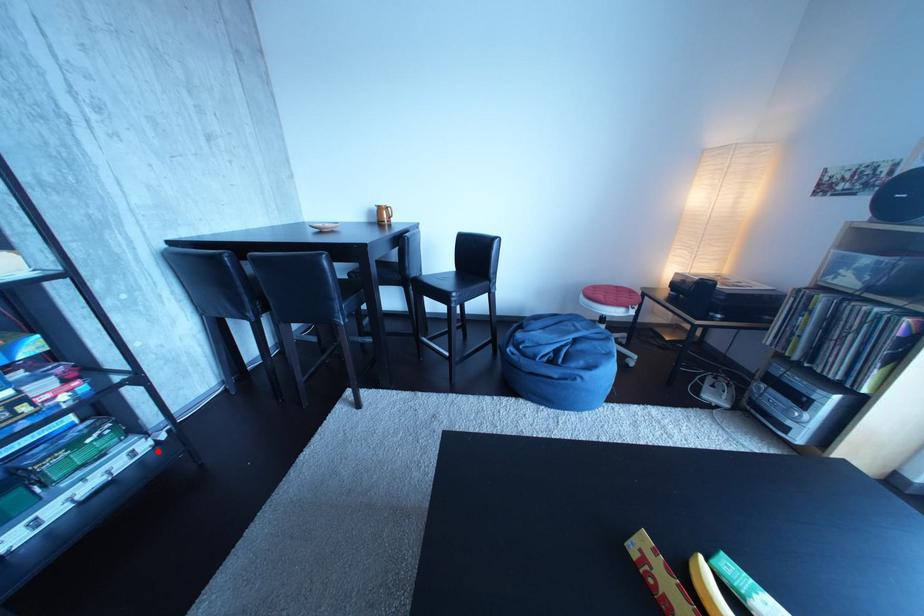
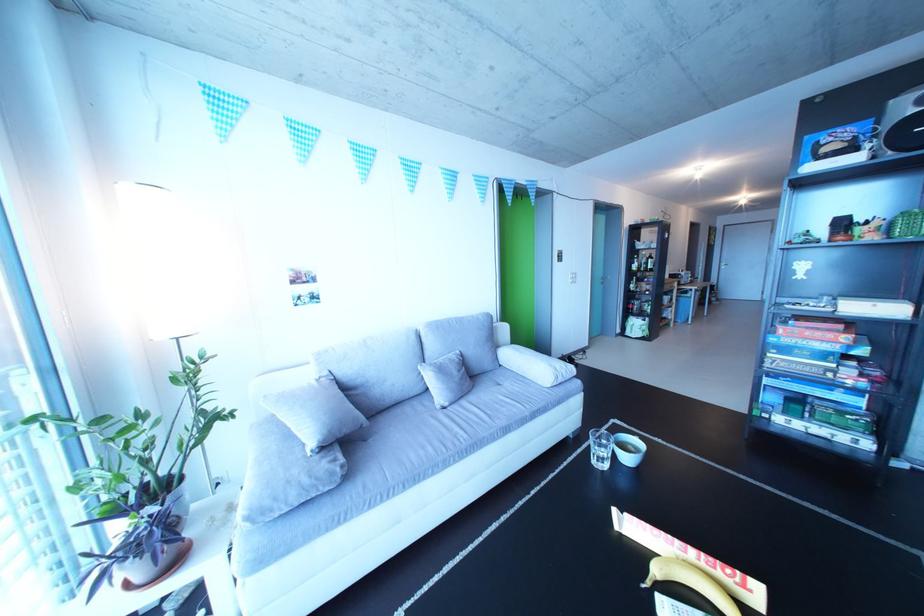
The point at the highlighted location is marked in the first image. Where is the corresponding point in the second image?

(881, 451)